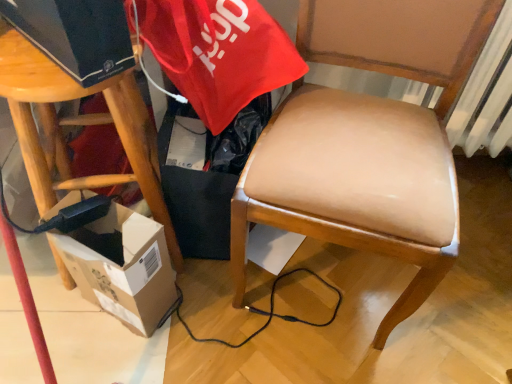
Identify the location of vacant space that is to the left of cardboard box at lower left. Image resolution: width=512 pixels, height=384 pixels. (41, 321).